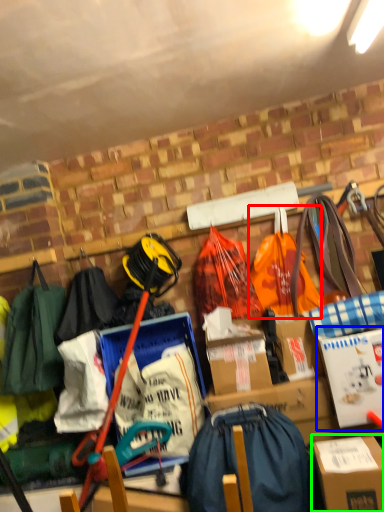
Question: Which object is positioned farthest from grocery bag (highlighted by a red box)? Select from cardboard box (highlighted by a blue box) and box (highlighted by a green box).

Choices:
 (A) cardboard box
 (B) box

Answer: (B)